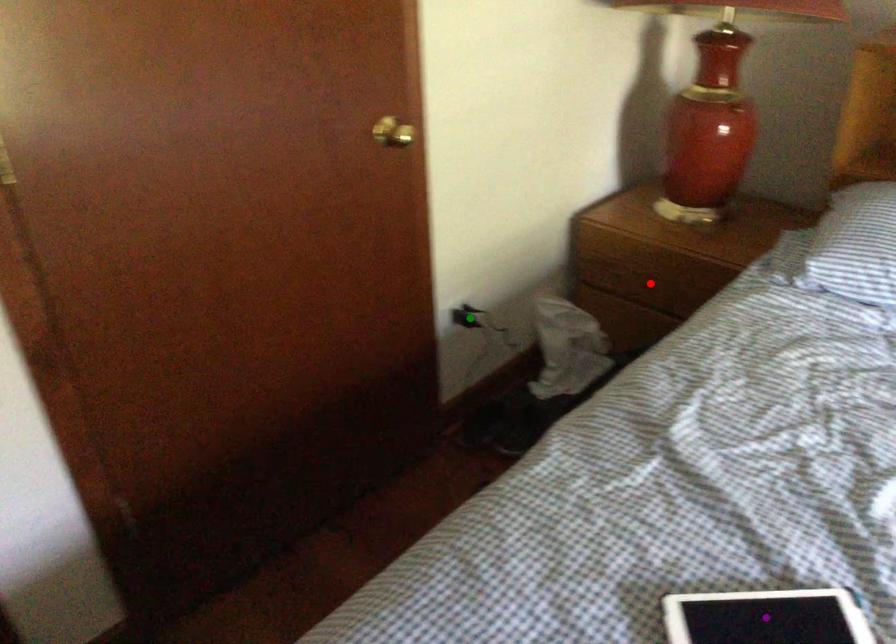
Order these from nearest to farthest:
red point | purple point | green point

1. red point
2. green point
3. purple point